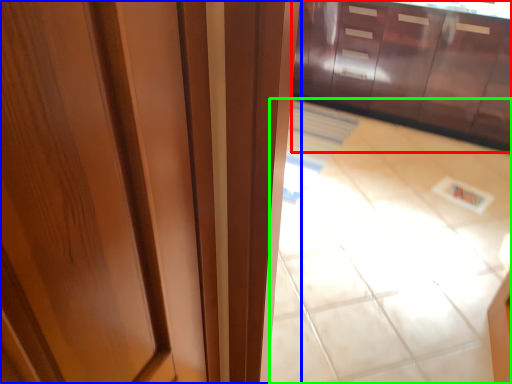
Question: Which is farther away from cabinetry (highlighted by a red box)? door (highlighted by a blue box) or tile (highlighted by a green box)?

Choices:
 (A) door
 (B) tile

Answer: (A)